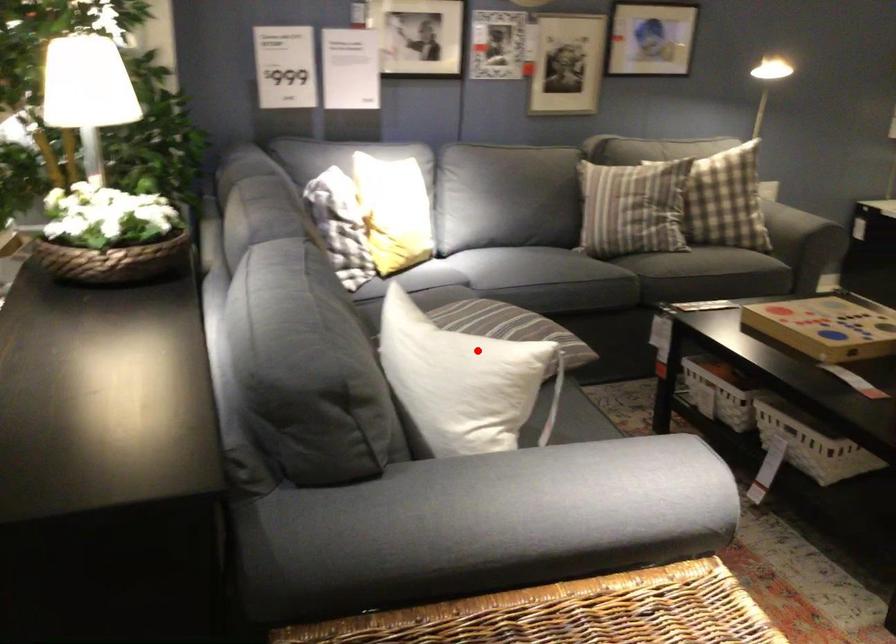
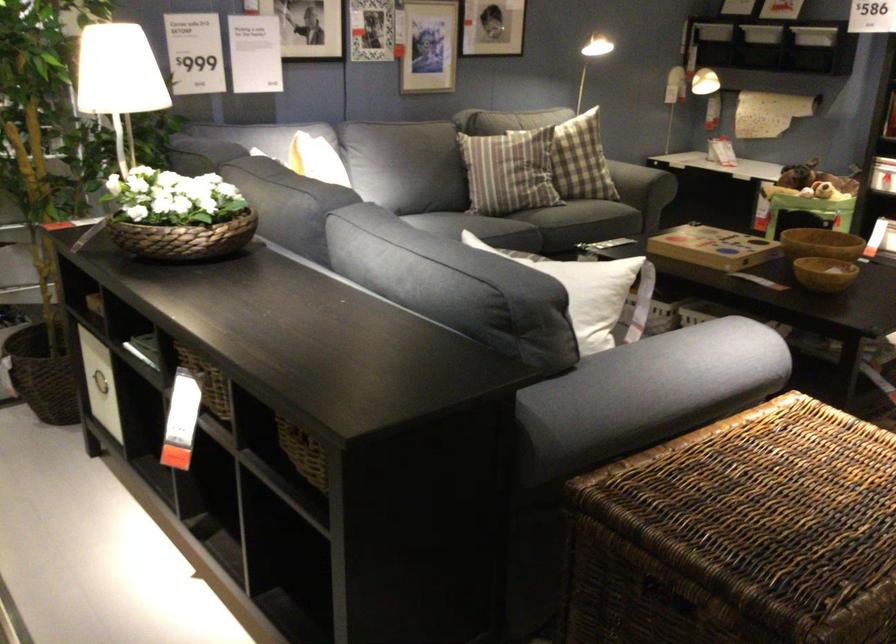
Question: I am providing you with two images of the same scene from different viewpoints. In image1, a red point is highlighted. Considering the same 3D point in image2, which of the following is correct?

Choices:
 (A) It is closer
 (B) It is farther

Answer: (B)